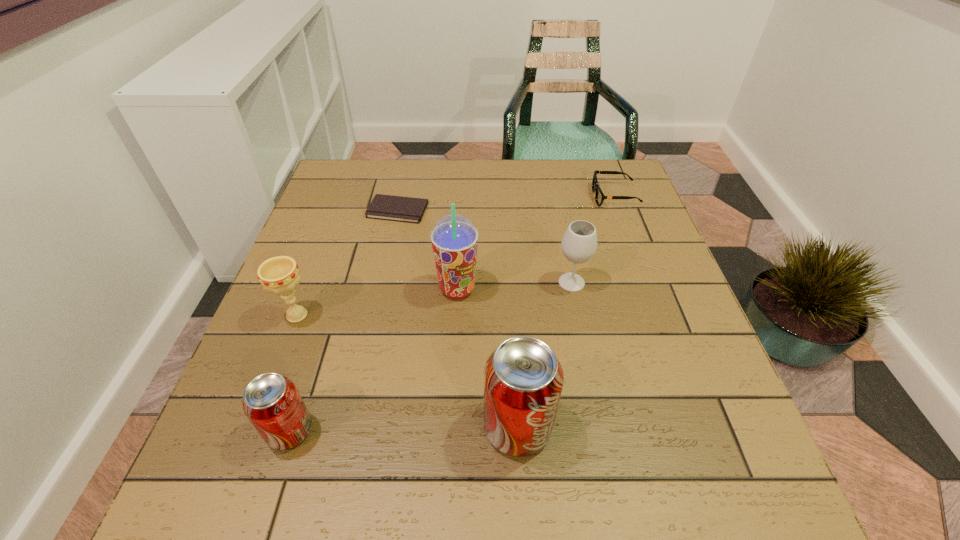
Locate an element on the screen. Image resolution: width=960 pixels, height=540 pixels. the shorter soda can is located at coordinates (272, 403).

Locate an element on the screen. The height and width of the screenshot is (540, 960). the sixth shortest object is located at coordinates (523, 379).

The image size is (960, 540). Identify the location of the right soda can. (523, 379).

Locate an element on the screen. Image resolution: width=960 pixels, height=540 pixels. the shortest object is located at coordinates click(384, 207).

Find the location of a particular element. This screenshot has width=960, height=540. wineglass is located at coordinates (579, 244).

At what (x,y) coordinates should I click in order to perform the action: click on sunglasses. Please return your answer as a coordinate pair (x, y). Looking at the image, I should click on (599, 196).

Image resolution: width=960 pixels, height=540 pixels. I want to click on the second shortest object, so click(599, 196).

The image size is (960, 540). I want to click on chalice, so click(x=280, y=275).

Identify the location of the fourth object from right to left. coord(454,238).

At what (x,y) coordinates should I click in order to perform the action: click on smoothie. Please return your answer as a coordinate pair (x, y). The width and height of the screenshot is (960, 540). Looking at the image, I should click on (454, 238).